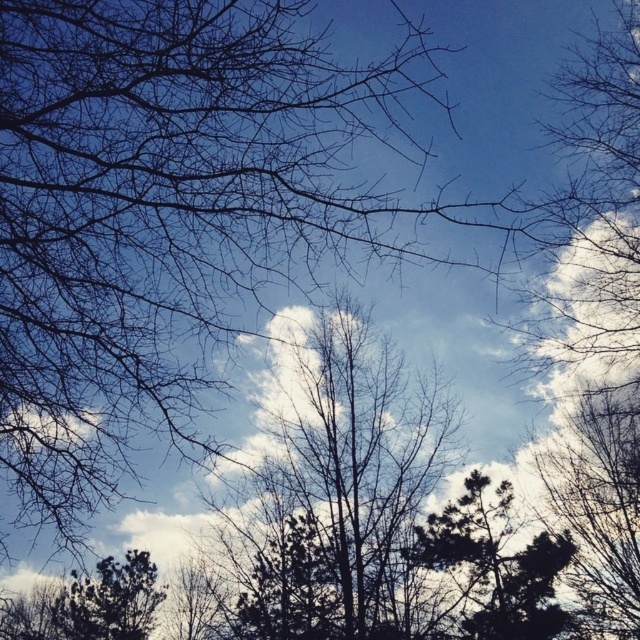
Is brown/dry wood tree at center taller than dark green textured tree at center?

Yes, brown/dry wood tree at center is taller than dark green textured tree at center.

Image resolution: width=640 pixels, height=640 pixels. What are the coordinates of `brown/dry wood tree at center` in the screenshot? It's located at (340, 493).